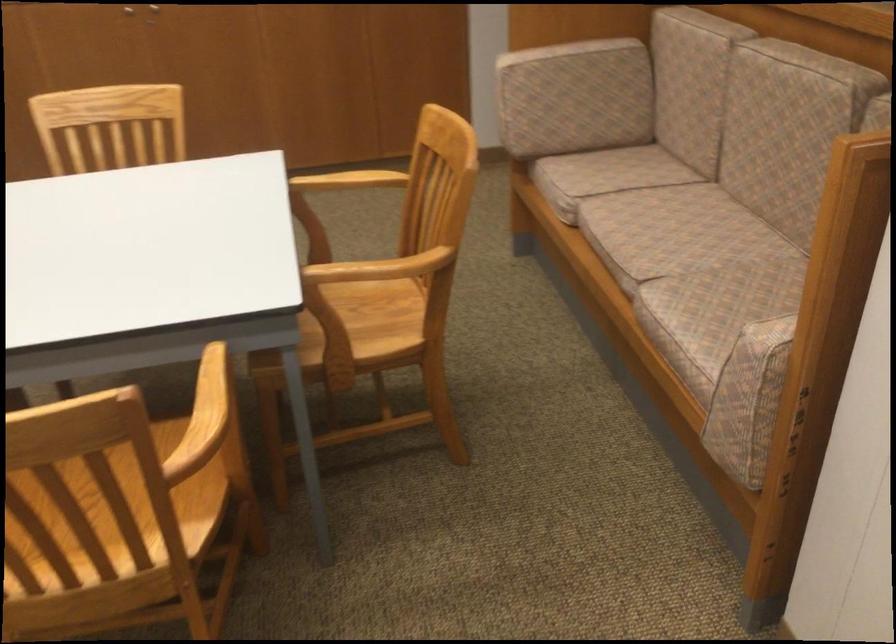
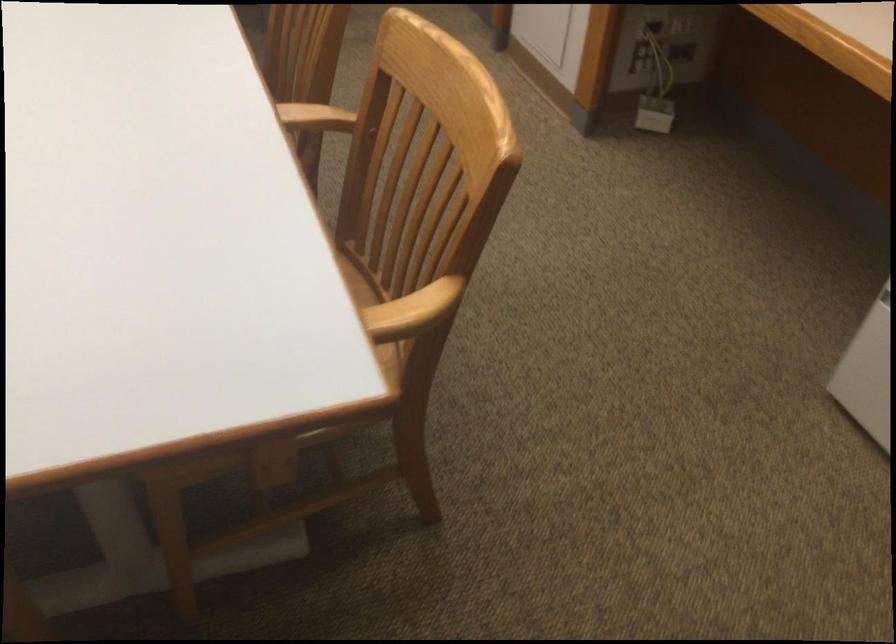
Question: In a continuous first-person perspective shot, in which direction is the camera moving?

Choices:
 (A) Left
 (B) Right
 (C) Forward
 (D) Backward

Answer: (D)